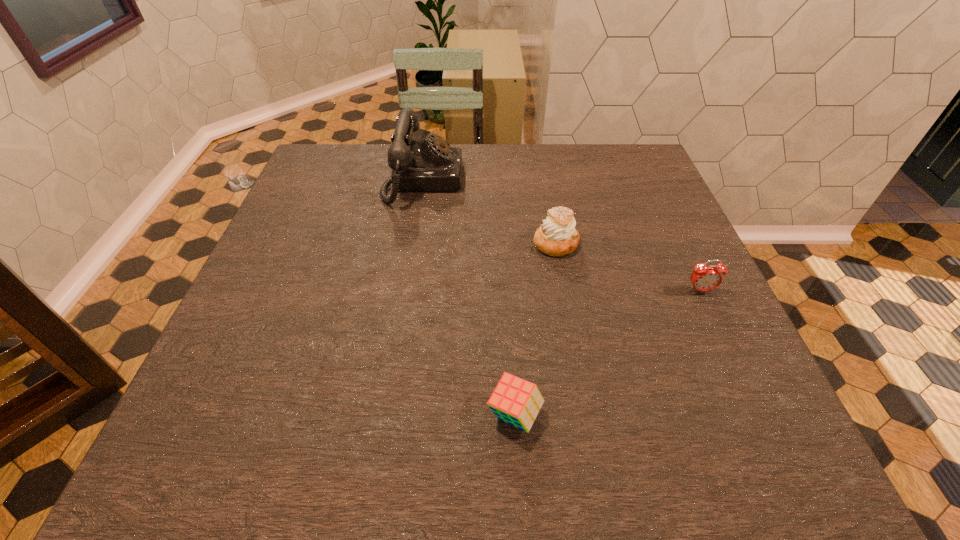
Where is `vacant area that lies between the farthest object and the pastry`? vacant area that lies between the farthest object and the pastry is located at coordinates (490, 212).

Locate an element on the screen. This screenshot has height=540, width=960. vacant space that's between the alarm clock and the pastry is located at coordinates (628, 267).

The height and width of the screenshot is (540, 960). In order to click on empty location between the third farthest object and the second farthest object in this screenshot , I will do `click(628, 267)`.

At what (x,y) coordinates should I click in order to perform the action: click on free spot between the nearest object and the second farthest object. Please return your answer as a coordinate pair (x, y). Looking at the image, I should click on (536, 329).

At what (x,y) coordinates should I click in order to perform the action: click on empty space that is in between the pastry and the second object from left to right. Please return your answer as a coordinate pair (x, y). The image size is (960, 540). Looking at the image, I should click on (536, 329).

Image resolution: width=960 pixels, height=540 pixels. I want to click on empty location between the second object from left to right and the alarm clock, so click(x=608, y=353).

I want to click on free area in between the second object from left to right and the alarm clock, so click(608, 353).

You are a GUI agent. You are given a task and a screenshot of the screen. Output one action in this format:
    pyautogui.click(x=<x>, y=<y>)
    Task: Click on the vacant area between the alarm clock and the second object from right to left
    The width and height of the screenshot is (960, 540).
    Given the screenshot: What is the action you would take?
    pyautogui.click(x=628, y=267)

The image size is (960, 540). Identify the location of the second closest object to the alarm clock. (515, 401).

The width and height of the screenshot is (960, 540). What are the coordinates of `object that is the second nearest to the second nearest object` in the screenshot? It's located at (515, 401).